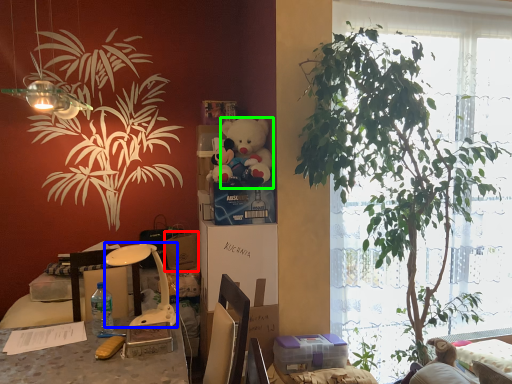
Question: Which object is the closest to the box (highlighted by a red box)? Choose among these: lamp (highlighted by a blue box) or teddy bear (highlighted by a green box).

Choices:
 (A) lamp
 (B) teddy bear

Answer: (A)